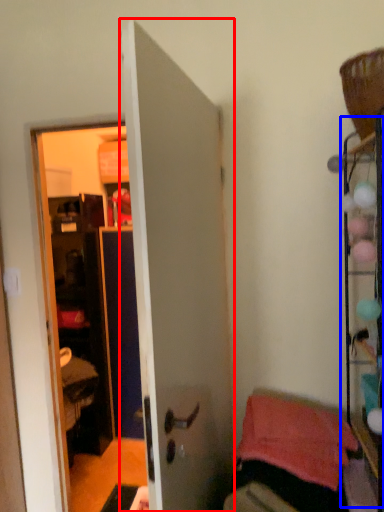
Question: Which of the following is the closest to the observer, door (highlighted by a red box) or shelf (highlighted by a blue box)?

Choices:
 (A) door
 (B) shelf

Answer: (A)